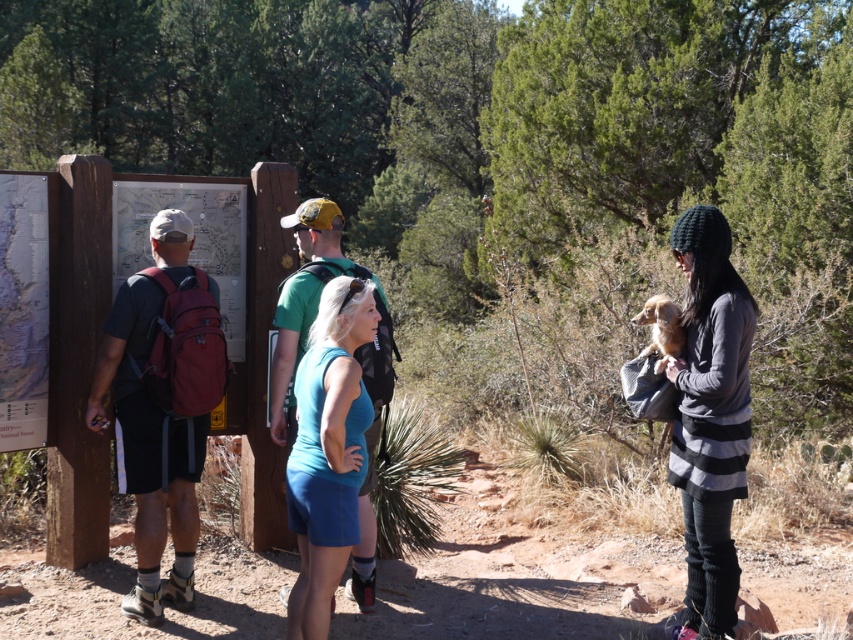
You are a photographer trying to capture a clear photo of the blue fabric tank top at center. However, the matte red backpack at left is blocking your view. Can you adjust your position to take the photo without moving the backpack?

The blue fabric tank top at center is behind the matte red backpack at left, so you can move to the side of the backpack to get an unobstructed view of the blue fabric tank top at center.

You are a photographer trying to capture a group photo of the knitted gray sweater at right and the blue fabric tank top at center. To ensure both are visible in the frame, where should you position the camera relative to the group?

The knitted gray sweater at right is positioned on the right side of the blue fabric tank top at center. Therefore, to include both in the frame, the camera should be positioned to the left of the group so that the knitted gray sweater at right and the blue fabric tank top at center are both visible.

You are a photographer trying to capture the knitted gray sweater at right and the blue fabric tank top at center in the same frame. Which piece of clothing is closer to your camera?

The knitted gray sweater at right is closer to the camera because it is further to the viewer than the blue fabric tank top at center.